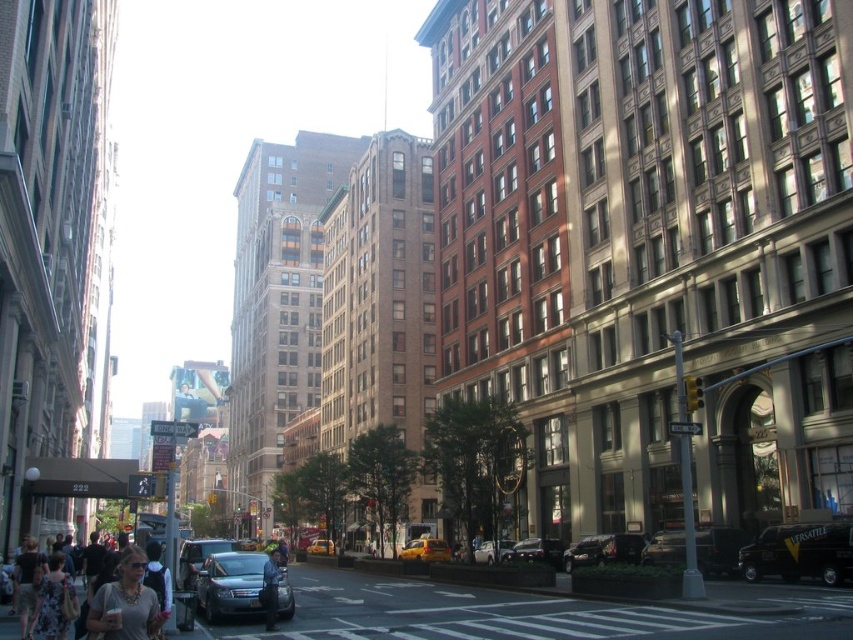
Does matte blue sedan at center have a larger size compared to matte silver sedan at center?

Actually, matte blue sedan at center might be smaller than matte silver sedan at center.

Who is more forward, (242,596) or (225,545)?

Point (242,596)

Between point (199, 576) and point (218, 541), which one is positioned in front?

Point (199, 576)

This screenshot has height=640, width=853. I want to click on matte blue sedan at center, so click(231, 584).

Between matte blue sedan at center and matte gray sweater at lower left, which one is positioned lower?

matte blue sedan at center is below.

Which is more to the right, matte blue sedan at center or matte gray sweater at lower left?

Positioned to the right is matte blue sedan at center.

Describe the element at coordinates (231, 584) in the screenshot. I see `matte blue sedan at center` at that location.

The height and width of the screenshot is (640, 853). What are the coordinates of `matte blue sedan at center` in the screenshot? It's located at (231, 584).

Can you confirm if floral dress at lower left is taller than yellow matte taxi cab at center?

Incorrect, floral dress at lower left's height is not larger of yellow matte taxi cab at center's.

Between point (53, 632) and point (332, 545), which one is positioned behind?

The point (332, 545) is behind.

Where is `floral dress at lower left`? This screenshot has height=640, width=853. floral dress at lower left is located at coordinates (54, 600).